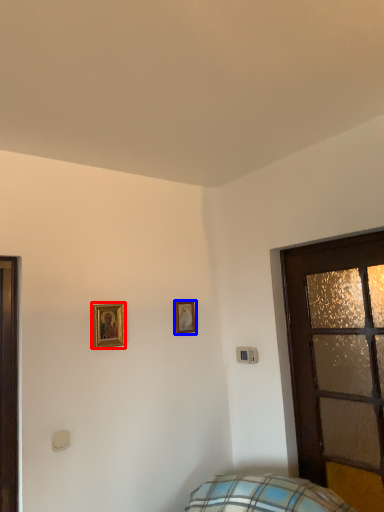
Question: Which point is further to the camera, picture frame (highlighted by a red box) or picture frame (highlighted by a blue box)?

Choices:
 (A) picture frame
 (B) picture frame

Answer: (B)